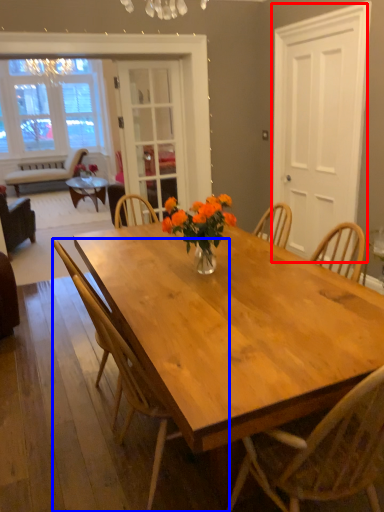
Question: Which object is further to the camera taking this photo, screen door (highlighted by a red box) or chair (highlighted by a blue box)?

Choices:
 (A) screen door
 (B) chair

Answer: (A)